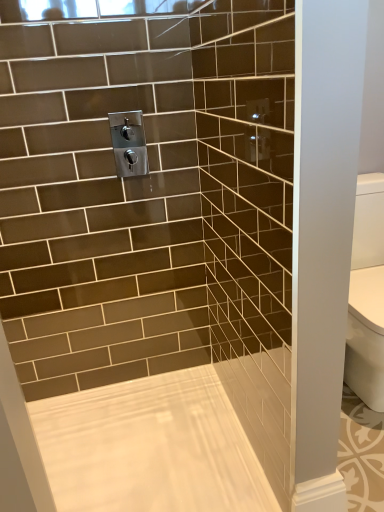
You are a GUI agent. You are given a task and a screenshot of the screen. Output one action in this format:
    pyautogui.click(x=<x>, y=<y>)
    Task: Click on the vacant area on top of white glossy bathtub at center (from a real-world perspective)
    
    Given the screenshot: What is the action you would take?
    pyautogui.click(x=167, y=436)